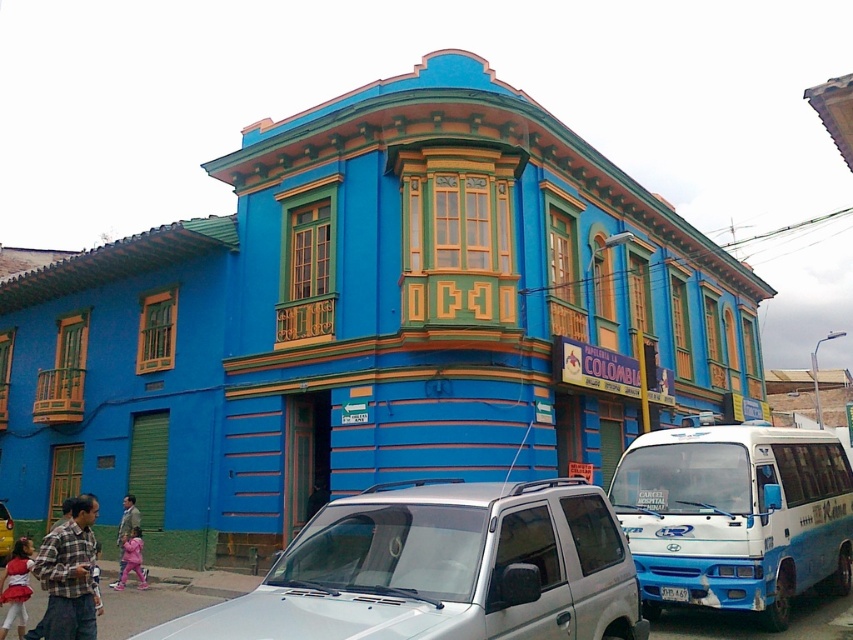
Question: Does silver metallic suv at center appear on the left side of plaid fabric shirt at lower left?

Choices:
 (A) no
 (B) yes

Answer: (A)

Question: Which object appears closest to the camera in this image?

Choices:
 (A) plaid fabric shirt at lower left
 (B) matte red dress at lower left

Answer: (A)

Question: Estimate the real-world distances between objects in this image. Which object is closer to the blue matte bus at lower right?

Choices:
 (A) metallic silver suv at center
 (B) matte red dress at lower left
 (C) plaid fabric shirt at lower left

Answer: (C)

Question: Can you confirm if silver metallic suv at center is thinner than blue matte bus at lower right?

Choices:
 (A) yes
 (B) no

Answer: (A)

Question: Can you confirm if plaid fabric shirt at lower left is wider than metallic silver suv at center?

Choices:
 (A) yes
 (B) no

Answer: (B)

Question: Which object appears farthest from the camera in this image?

Choices:
 (A) matte red dress at lower left
 (B) metallic silver suv at center
 (C) blue matte bus at lower right
 (D) plaid fabric shirt at lower left

Answer: (B)